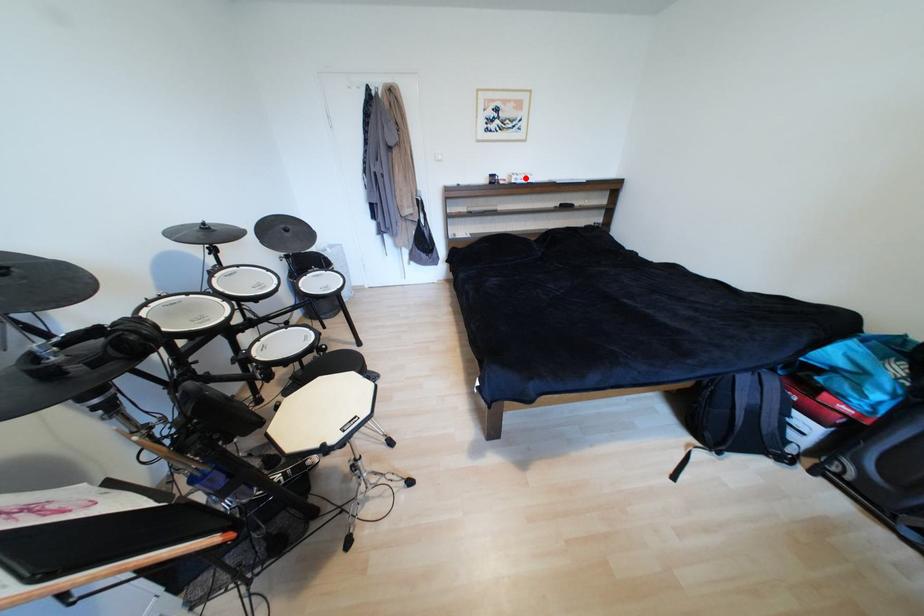
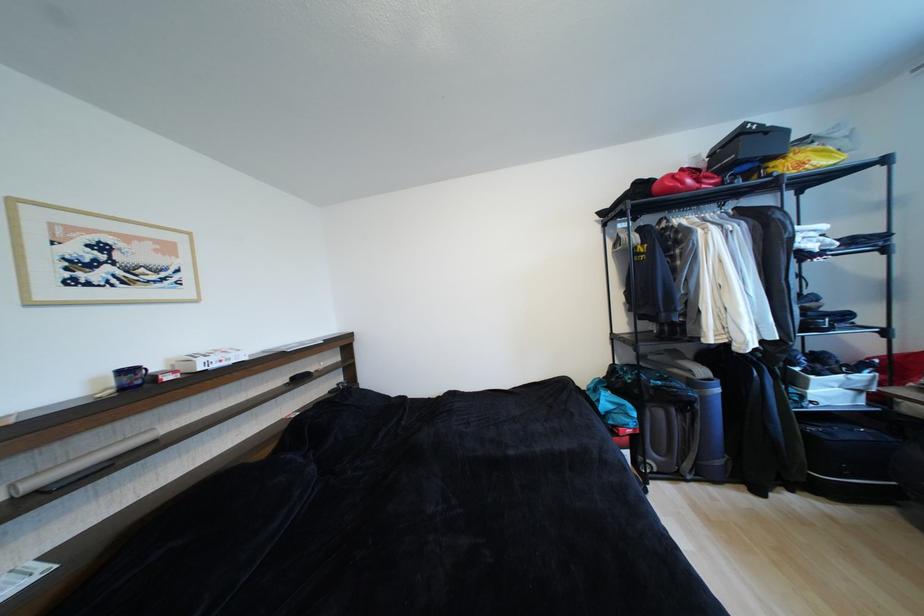
Question: I am providing you with two images of the same scene from different viewpoints. A red point is marked on the first image. Is the red point's position out of view in image 2?

Choices:
 (A) Yes
 (B) No

Answer: (B)